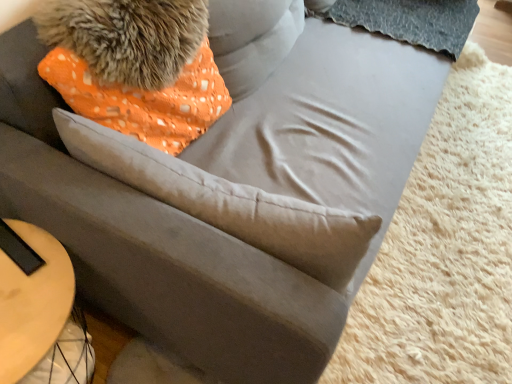
This screenshot has height=384, width=512. What do you see at coordinates (127, 37) in the screenshot?
I see `fuzzy fur at upper left` at bounding box center [127, 37].

What do you see at coordinates (229, 203) in the screenshot? The height and width of the screenshot is (384, 512). I see `orange dotted fabric pillow at upper left` at bounding box center [229, 203].

Where is `fuzzy fur at upper left`? fuzzy fur at upper left is located at coordinates (127, 37).

Can you see fuzzy fur at upper left touching orange dotted fabric pillow at upper left?

No.

Who is bigger, fuzzy fur at upper left or orange dotted fabric pillow at upper left?

orange dotted fabric pillow at upper left is bigger.

Does fuzzy fur at upper left turn towards orange dotted fabric pillow at upper left?

Yes, fuzzy fur at upper left faces towards orange dotted fabric pillow at upper left.

Which of these two, fuzzy fur at upper left or orange dotted fabric pillow at upper left, stands shorter?

fuzzy fur at upper left is shorter.

Considering the relative positions of fuzzy fur at upper left and light wood table at lower left in the image provided, is fuzzy fur at upper left behind light wood table at lower left?

Yes, fuzzy fur at upper left is behind light wood table at lower left.

How different are the orientations of fuzzy fur at upper left and light wood table at lower left in degrees?

The angle between the facing direction of fuzzy fur at upper left and the facing direction of light wood table at lower left is 0.435 degrees.

Is point (172, 9) less distant than point (9, 246)?

No, (172, 9) is further to viewer.

Find the location of `table below the fuzzy fur at upper left (from the image's perspective)`. table below the fuzzy fur at upper left (from the image's perspective) is located at coordinates (31, 296).

Locate an element on the screen. throw pillow in front of the light wood table at lower left is located at coordinates (229, 203).

From the image's perspective, relative to orange dotted fabric pillow at upper left, is light wood table at lower left above or below?

From the image's perspective, light wood table at lower left appears below orange dotted fabric pillow at upper left.

Looking at their sizes, would you say light wood table at lower left is wider or thinner than orange dotted fabric pillow at upper left?

In the image, light wood table at lower left appears to be wider than orange dotted fabric pillow at upper left.

Is light wood table at lower left facing towards orange dotted fabric pillow at upper left?

No, light wood table at lower left does not turn towards orange dotted fabric pillow at upper left.

In the scene shown: How distant is light wood table at lower left from fuzzy fur at upper left?

light wood table at lower left is 19.66 inches from fuzzy fur at upper left.

From the image's perspective, is light wood table at lower left below fuzzy fur at upper left?

Yes, from the image's perspective, light wood table at lower left is beneath fuzzy fur at upper left.

Would you say light wood table at lower left contains fuzzy fur at upper left?

No.

Is light wood table at lower left turned away from fuzzy fur at upper left?

No, light wood table at lower left's orientation is not away from fuzzy fur at upper left.

From a real-world perspective, is orange dotted fabric pillow at upper left over light wood table at lower left?

Correct, in the physical world, orange dotted fabric pillow at upper left is higher than light wood table at lower left.

Could you tell me if orange dotted fabric pillow at upper left is turned towards light wood table at lower left?

No, orange dotted fabric pillow at upper left is not oriented towards light wood table at lower left.

How different are the orientations of orange dotted fabric pillow at upper left and light wood table at lower left in degrees?

The angular difference between orange dotted fabric pillow at upper left and light wood table at lower left is 92.7 degrees.

Which is behind, point (239, 237) or point (64, 317)?

The point (64, 317) is farther.

Is orange dotted fabric pillow at upper left bigger or smaller than fuzzy fur at upper left?

Clearly, orange dotted fabric pillow at upper left is larger in size than fuzzy fur at upper left.

Image resolution: width=512 pixels, height=384 pixels. In order to click on animal behind the orange dotted fabric pillow at upper left in this screenshot , I will do `click(127, 37)`.

Between orange dotted fabric pillow at upper left and fuzzy fur at upper left, which one appears on the right side from the viewer's perspective?

orange dotted fabric pillow at upper left.

Do you think orange dotted fabric pillow at upper left is within fuzzy fur at upper left, or outside of it?

orange dotted fabric pillow at upper left is outside fuzzy fur at upper left.

The height and width of the screenshot is (384, 512). I want to click on throw pillow on the right side of fuzzy fur at upper left, so click(229, 203).

Locate an element on the screen. table that is on the left side of fuzzy fur at upper left is located at coordinates (31, 296).

Considering their positions, is fuzzy fur at upper left positioned further to orange dotted fabric pillow at upper left than light wood table at lower left?

light wood table at lower left lies further to orange dotted fabric pillow at upper left than the other object.

From the image, which object appears to be farther from light wood table at lower left, orange dotted fabric pillow at upper left or fuzzy fur at upper left?

fuzzy fur at upper left lies further to light wood table at lower left than the other object.

Which object lies nearer to the anchor point orange dotted fabric pillow at upper left, light wood table at lower left or fuzzy fur at upper left?

fuzzy fur at upper left is closer to orange dotted fabric pillow at upper left.

Looking at the image, which one is located closer to light wood table at lower left, fuzzy fur at upper left or orange dotted fabric pillow at upper left?

orange dotted fabric pillow at upper left lies closer to light wood table at lower left than the other object.

Consider the image. Which object lies nearer to the anchor point fuzzy fur at upper left, orange dotted fabric pillow at upper left or light wood table at lower left?

Among the two, orange dotted fabric pillow at upper left is located nearer to fuzzy fur at upper left.

Which object lies nearer to the anchor point fuzzy fur at upper left, light wood table at lower left or orange dotted fabric pillow at upper left?

orange dotted fabric pillow at upper left.

The width and height of the screenshot is (512, 384). In order to click on throw pillow between fuzzy fur at upper left and light wood table at lower left vertically in this screenshot , I will do `click(229, 203)`.